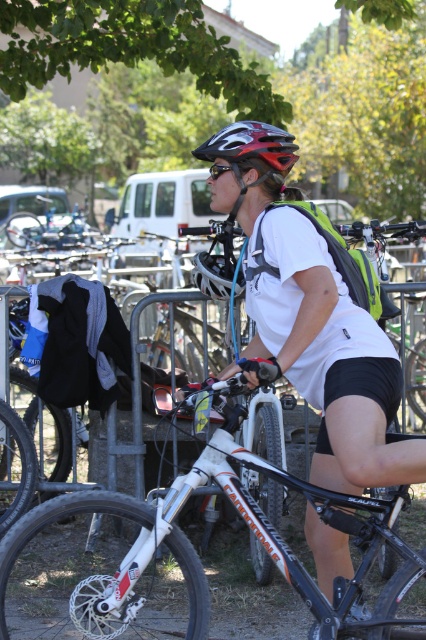
Question: Which point is farther from the camera taking this photo?

Choices:
 (A) (270, 136)
 (B) (13, 627)
 (C) (215, 140)
 (D) (233, 168)

Answer: (B)

Question: Does white matte shirt at center appear over black matte sunglasses at center?

Choices:
 (A) no
 (B) yes

Answer: (A)

Question: Which object appears closest to the camera in this image?

Choices:
 (A) white matte mountain bike at center
 (B) white matte shirt at center

Answer: (B)

Question: Can you confirm if shiny black helmet at center is positioned below black matte sunglasses at center?

Choices:
 (A) yes
 (B) no

Answer: (A)

Question: From the image, what is the correct spatial relationship of white matte shirt at center in relation to black matte sunglasses at center?

Choices:
 (A) left
 (B) right

Answer: (B)

Question: Which is farther from the white matte mountain bike at center?

Choices:
 (A) white matte shirt at center
 (B) shiny black helmet at center
 (C) black matte sunglasses at center

Answer: (C)